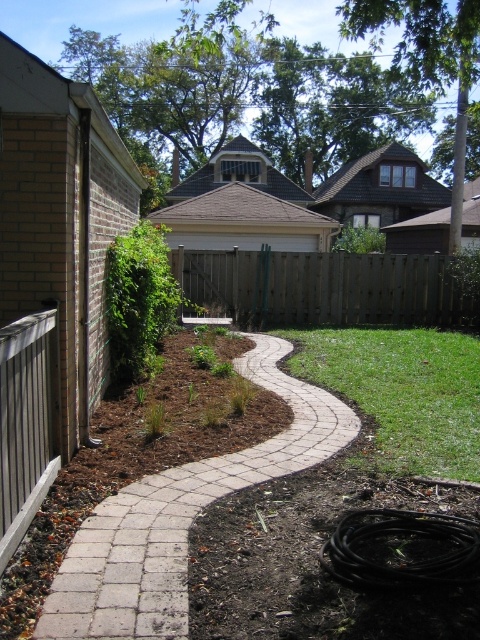
You are designing a garden layout and need to place a 3x3 meter square garden bed. Given the white brick path at center and the green grass at lower right, which area can accommodate the garden bed based on their sizes?

The green grass at lower right has a larger size than the white brick path at center, so it can accommodate the 3x3 meter square garden bed.

You are a gardener planning to install a sprinkler system along the white brick path at center. The sprinkler system requires a clear vertical space of at least 30 cm above the path to function properly. Can the brown wood fence at center interfere with the sprinkler system installation?

The white brick path at center is below the brown wood fence at center, so the fence is positioned above the path. This means there is sufficient vertical space between the path and the fence for the sprinkler system to operate without interference.

Based on the photo, you are standing in the backyard and want to place a small decorative statue exactly at point (437,340) and another statue at point (189,284). Which statue will appear larger in the photo taken from your current position?

The statue placed at point (437,340) will appear larger in the photo because it is closer to the camera than point (189,284).